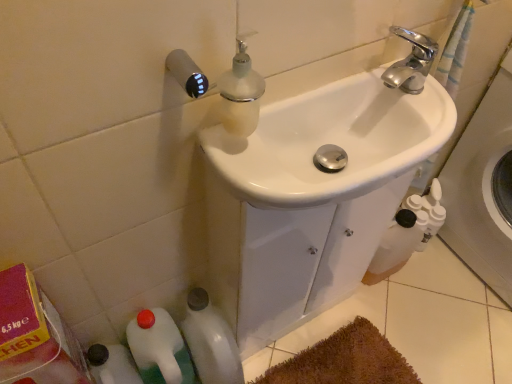
Question: From a real-world perspective, relative to white plastic bottles at right, is white plastic bottle at lower left, the second bottle when ordered from right to left, vertically above or below?

Choices:
 (A) above
 (B) below

Answer: (B)

Question: Considering the positions of white plastic bottle at lower left, which ranks as the 1th bottle in left-to-right order, and white plastic bottles at right in the image, is white plastic bottle at lower left, which ranks as the 1th bottle in left-to-right order, taller or shorter than white plastic bottles at right?

Choices:
 (A) short
 (B) tall

Answer: (A)

Question: Which object is the closest to the white glossy sink at center?

Choices:
 (A) white glossy bottle at lower left, the first bottle when ordered from right to left
 (B) white plastic bottle at lower left, the second bottle when ordered from right to left
 (C) white plastic bottles at right

Answer: (A)

Question: Which is farther from the white plastic bottle at lower left, the second bottle when ordered from right to left?

Choices:
 (A) white plastic bottles at right
 (B) white glossy bottle at lower left, the first bottle when ordered from right to left
 (C) white glossy sink at center

Answer: (A)